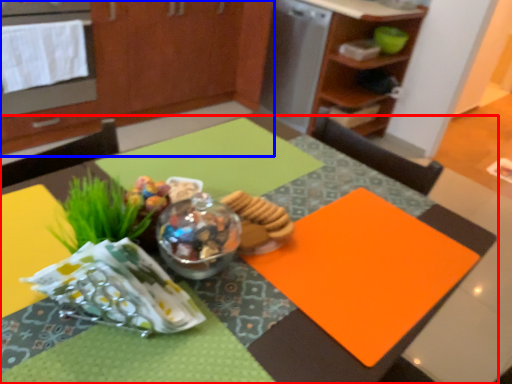
Question: Which of the following is the closest to the observer, table (highlighted by a red box) or cabinetry (highlighted by a blue box)?

Choices:
 (A) table
 (B) cabinetry

Answer: (A)